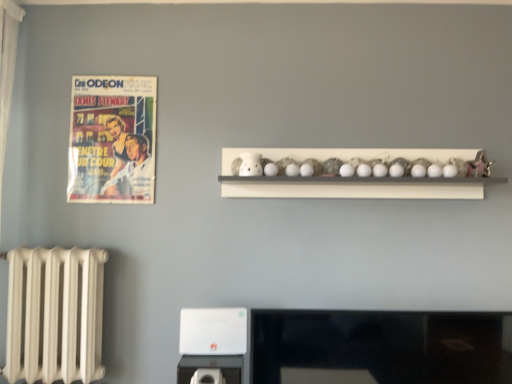
Question: Is white matte shelf at upper center looking in the opposite direction of matte paper poster at upper left?

Choices:
 (A) no
 (B) yes

Answer: (A)

Question: Can you confirm if white matte shelf at upper center is taller than matte paper poster at upper left?

Choices:
 (A) no
 (B) yes

Answer: (A)

Question: From the image's perspective, would you say white matte shelf at upper center is positioned over matte paper poster at upper left?

Choices:
 (A) yes
 (B) no

Answer: (B)

Question: Is white matte shelf at upper center aimed at matte paper poster at upper left?

Choices:
 (A) yes
 (B) no

Answer: (B)

Question: Does white matte shelf at upper center have a larger size compared to matte paper poster at upper left?

Choices:
 (A) no
 (B) yes

Answer: (B)

Question: In the image, is white matte shelf at upper center on the left side or the right side of matte paper poster at upper left?

Choices:
 (A) left
 (B) right

Answer: (B)

Question: Considering the positions of point click(x=331, y=193) and point click(x=134, y=84), is point click(x=331, y=193) closer or farther from the camera than point click(x=134, y=84)?

Choices:
 (A) closer
 (B) farther

Answer: (A)

Question: From a real-world perspective, is white matte shelf at upper center above or below matte paper poster at upper left?

Choices:
 (A) above
 (B) below

Answer: (B)

Question: From the image's perspective, is white matte shelf at upper center positioned above or below matte paper poster at upper left?

Choices:
 (A) below
 (B) above

Answer: (A)

Question: From a real-world perspective, is matte paper poster at upper left positioned above or below white matte shelf at upper center?

Choices:
 (A) above
 (B) below

Answer: (A)

Question: In terms of height, does matte paper poster at upper left look taller or shorter compared to white matte shelf at upper center?

Choices:
 (A) tall
 (B) short

Answer: (A)

Question: Is point [80, 173] positioned closer to the camera than point [259, 155]?

Choices:
 (A) closer
 (B) farther

Answer: (B)

Question: Considering the positions of matte paper poster at upper left and white matte shelf at upper center in the image, is matte paper poster at upper left wider or thinner than white matte shelf at upper center?

Choices:
 (A) thin
 (B) wide

Answer: (A)

Question: In the image, is white plastic appliance at lower center on the left side or the right side of white matte shelf at upper center?

Choices:
 (A) right
 (B) left

Answer: (B)

Question: Is white plastic appliance at lower center taller or shorter than white matte shelf at upper center?

Choices:
 (A) tall
 (B) short

Answer: (B)